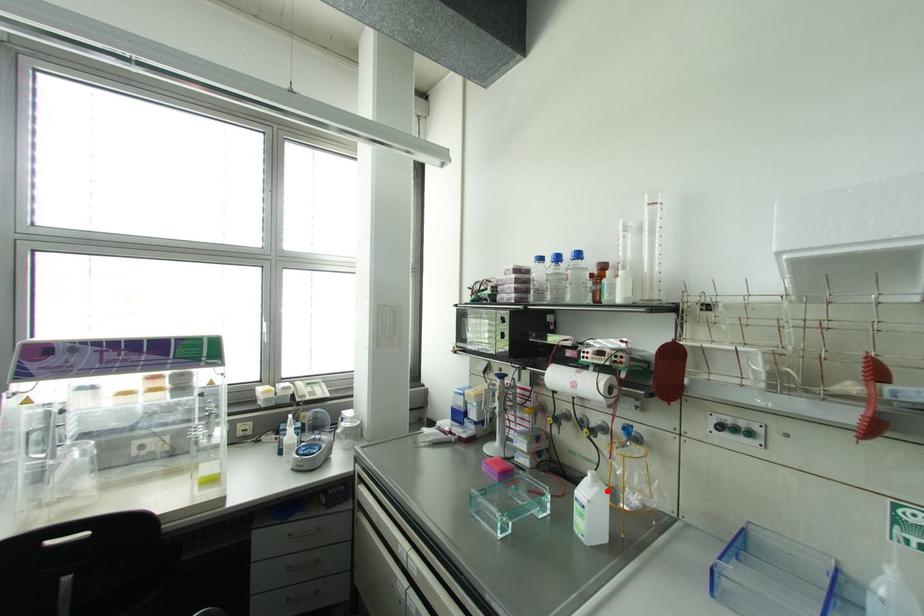
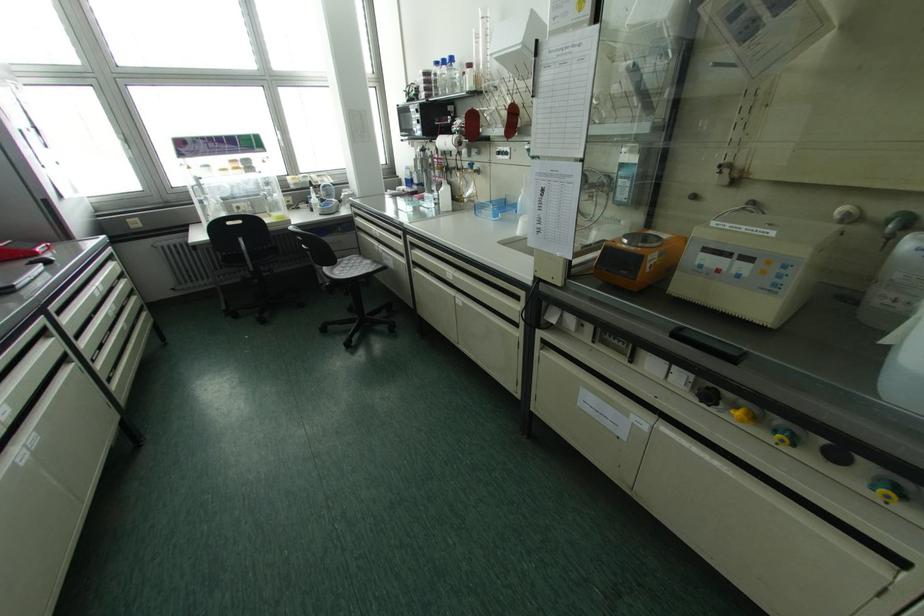
Question: I am providing you with two images of the same scene from different viewpoints. In image1, a red point is highlighted. Considering the same 3D point in image2, which of the following is correct?

Choices:
 (A) It is closer
 (B) It is farther

Answer: (A)